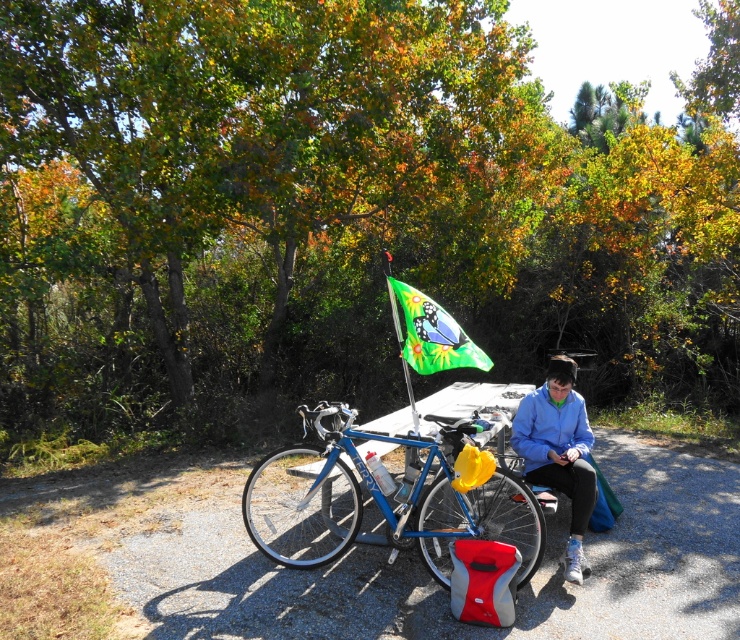
Question: Which object appears farthest from the camera in this image?

Choices:
 (A) blue metallic bicycle at center
 (B) green fabric flag at center
 (C) blue fabric jacket at center

Answer: (B)

Question: Which of these objects is positioned closest to the blue fabric jacket at center?

Choices:
 (A) green fabric flag at center
 (B) blue metallic bicycle at center

Answer: (A)

Question: Does blue metallic bicycle at center have a larger size compared to blue fabric jacket at center?

Choices:
 (A) no
 (B) yes

Answer: (B)

Question: Can you confirm if blue metallic bicycle at center is wider than blue fabric jacket at center?

Choices:
 (A) no
 (B) yes

Answer: (B)

Question: Which point is farther to the camera?

Choices:
 (A) (340, 451)
 (B) (595, 497)
 (C) (423, 344)

Answer: (C)

Question: Is the position of blue metallic bicycle at center less distant than that of green fabric flag at center?

Choices:
 (A) no
 (B) yes

Answer: (B)